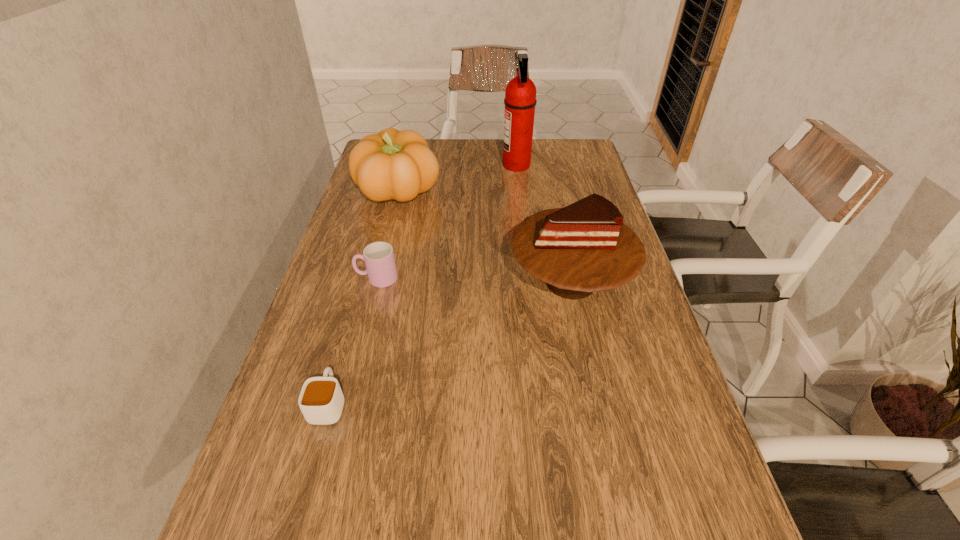
Where is `vacant space positioned on the right of the pumpkin`? The image size is (960, 540). vacant space positioned on the right of the pumpkin is located at coordinates (524, 192).

Locate an element on the screen. This screenshot has height=540, width=960. free space located 0.400m on the back of the cake is located at coordinates (546, 168).

At what (x,y) coordinates should I click in order to perform the action: click on vacant area situated 0.080m with the handle on the side of the farther cup. Please return your answer as a coordinate pair (x, y). Looking at the image, I should click on (324, 278).

Where is `vacant space located 0.380m on the side with the handle of the nearest object`? The image size is (960, 540). vacant space located 0.380m on the side with the handle of the nearest object is located at coordinates (370, 256).

Locate an element on the screen. This screenshot has height=540, width=960. vacant area located 0.230m on the side with the handle of the nearest object is located at coordinates (358, 298).

Image resolution: width=960 pixels, height=540 pixels. I want to click on blank space located on the side with the handle of the nearest object, so click(357, 301).

Find the location of `fire extinguisher at the far edge`. fire extinguisher at the far edge is located at coordinates (520, 100).

The height and width of the screenshot is (540, 960). I want to click on pumpkin situated at the far edge, so click(393, 164).

Identify the location of pumpkin at the left edge. The width and height of the screenshot is (960, 540). (393, 164).

The width and height of the screenshot is (960, 540). Find the location of `object that is at the right edge`. object that is at the right edge is located at coordinates (582, 248).